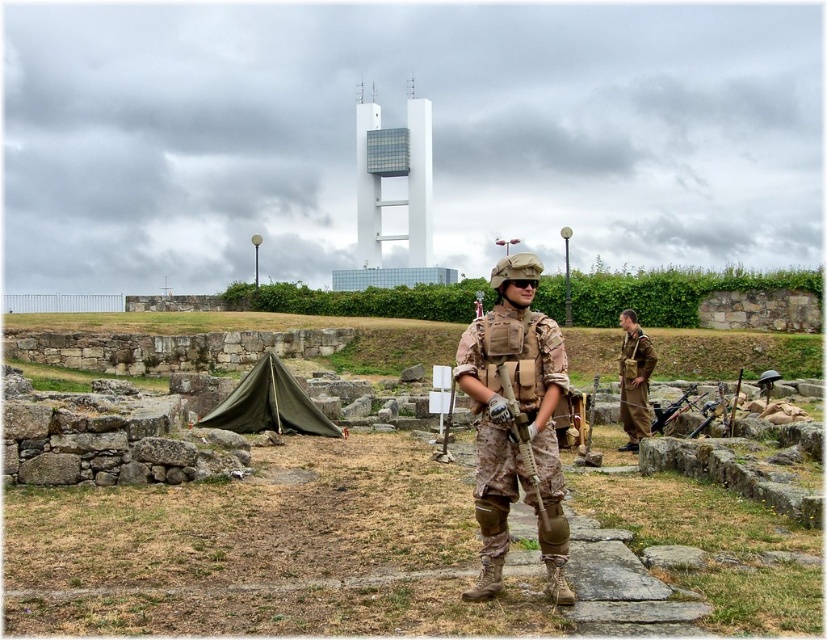
You are a photographer trying to capture the camouflage fabric rifle at center in your shot. If your camera has a crosshair at the center of the frame, which is at coordinate point 0.5, 0.5, will the rifle be centered in your photo?

The camouflage fabric rifle at center is located at point (522, 440), which is to the right and slightly below the center point of the frame. Therefore, the rifle will not be centered in the photo.

You are a photographer at the historical site. You need to capture a photo where both the camouflage fabric uniform at center and the brown fabric uniform at right are visible. Based on their positions, which uniform is positioned lower in the frame?

The camouflage fabric uniform at center is below brown fabric uniform at right, so the camouflage fabric uniform at center is positioned lower in the frame.

You are a photographer at the historical site. You want to place a small flag exactly halfway between point (500, 291) and point (619, 388). Will the flag be closer to the front or the back of the scene?

The flag placed halfway between point (500, 291) and point (619, 388) will be closer to the back of the scene because point (500, 291) is closer to the viewer than point (619, 388), so the midpoint leans towards the farther point.